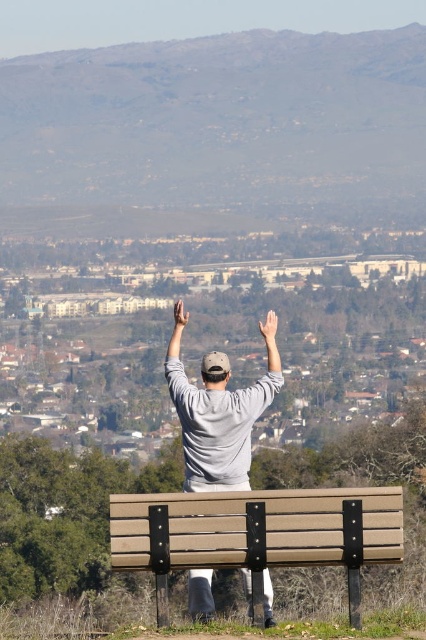
Question: Is beige wood bench at center to the right of smooth beige hand at upper center from the viewer's perspective?

Choices:
 (A) yes
 (B) no

Answer: (A)

Question: Which is farther from the smooth beige hand at upper center?

Choices:
 (A) gray matte arm at upper center
 (B) beige wood bench at center

Answer: (B)

Question: Is gray matte arm at center bigger than gray matte arm at upper center?

Choices:
 (A) no
 (B) yes

Answer: (B)

Question: Which of the following is the closest to the observer?

Choices:
 (A) smooth beige hand at upper center
 (B) gray matte arm at upper center

Answer: (B)

Question: Estimate the real-world distances between objects in this image. Which object is farther from the light skin tone hand at upper center?

Choices:
 (A) gray matte arm at center
 (B) smooth beige hand at upper center

Answer: (B)

Question: Can you confirm if gray matte arm at center is bigger than gray matte arm at upper center?

Choices:
 (A) yes
 (B) no

Answer: (A)